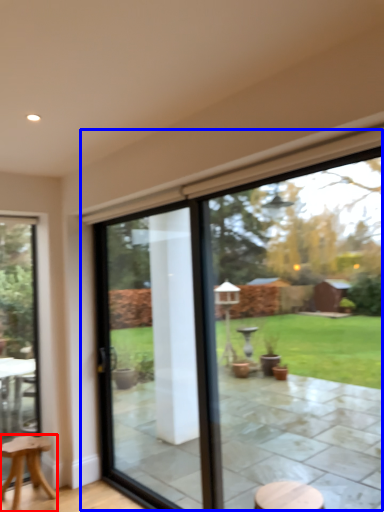
Question: Which of the following is the farthest to the observer, stool (highlighted by a red box) or window (highlighted by a blue box)?

Choices:
 (A) stool
 (B) window

Answer: (A)